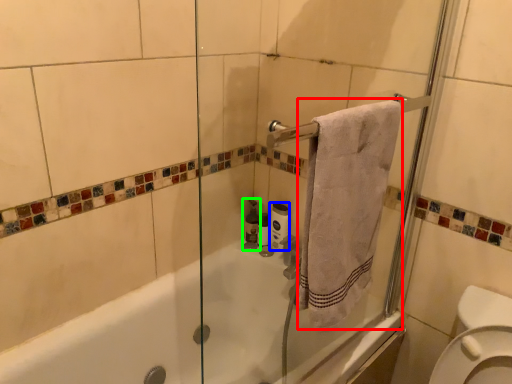
Question: Based on their relative distances, which object is farther from bath towel (highlighted by a red box)? Choose from toilet paper (highlighted by a blue box) and toiletry (highlighted by a green box).

Choices:
 (A) toilet paper
 (B) toiletry

Answer: (B)